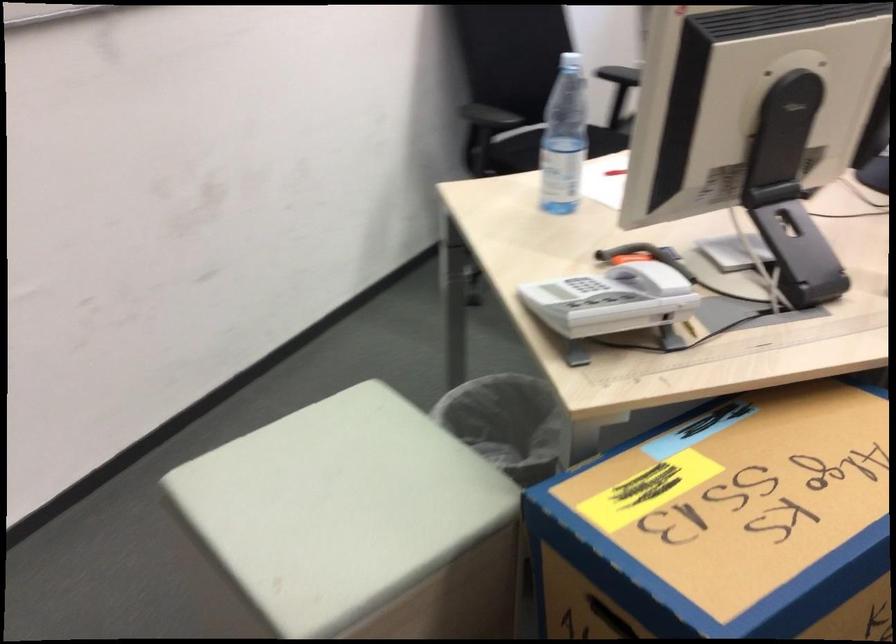
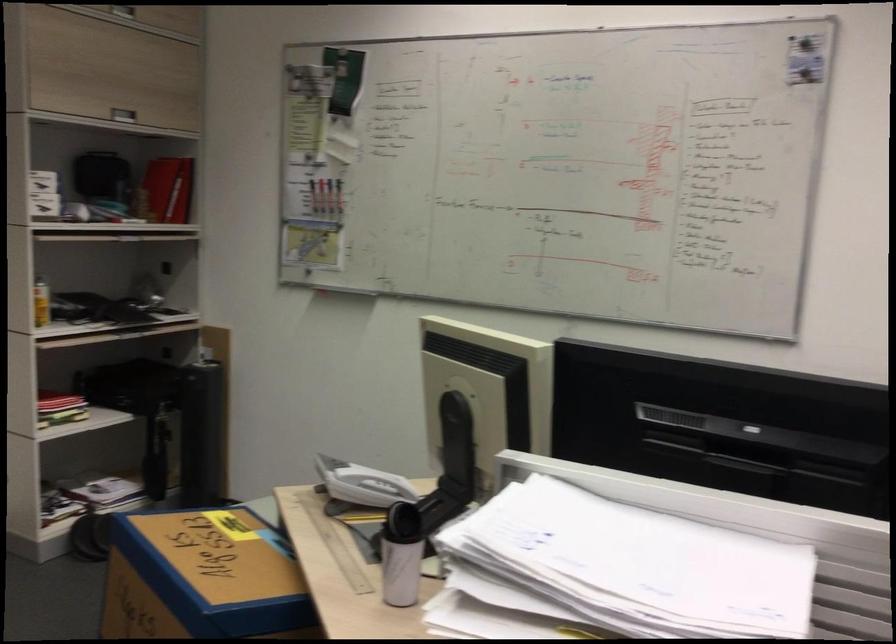
Question: I am providing you with two images of the same scene from different viewpoints. Which of the following objects are not visible in image2?

Choices:
 (A) cardboard box handle
 (B) silver cabinet handle
 (C) small white basket
 (D) black storage case

Answer: (A)